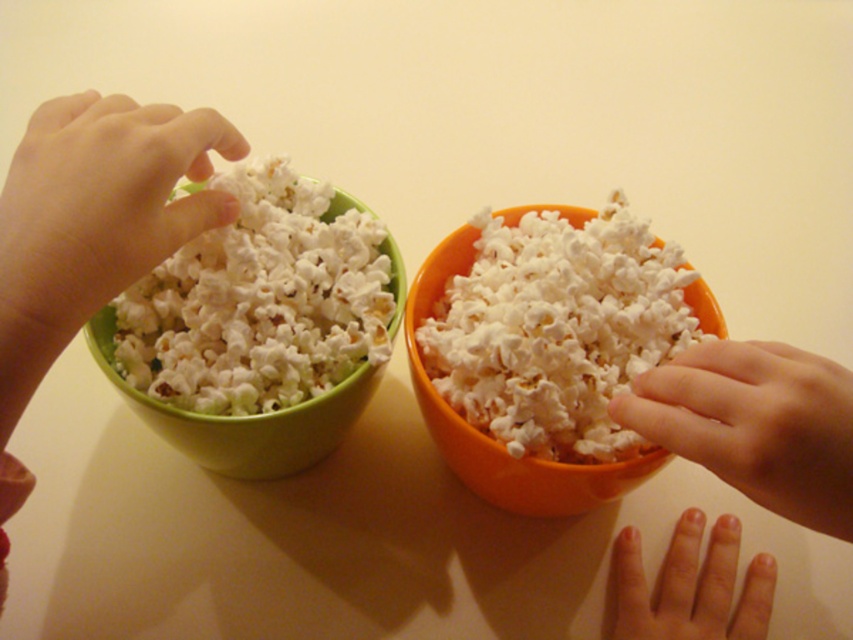
In the scene shown: Does white fluffy popcorn at left have a lesser width compared to matte white hand at left?

Incorrect, white fluffy popcorn at left's width is not less than matte white hand at left's.

Identify the location of white fluffy popcorn at left. Image resolution: width=853 pixels, height=640 pixels. (260, 301).

This screenshot has height=640, width=853. Find the location of `white fluffy popcorn at left`. white fluffy popcorn at left is located at coordinates (260, 301).

Does white fluffy popcorn at right appear over white fluffy popcorn at left?

No, white fluffy popcorn at right is not above white fluffy popcorn at left.

Locate an element on the screen. Image resolution: width=853 pixels, height=640 pixels. white fluffy popcorn at right is located at coordinates (556, 330).

What are the coordinates of `white fluffy popcorn at right` in the screenshot? It's located at (556, 330).

Is matte white hand at left positioned behind smooth skin hand at center?

No, it is in front of smooth skin hand at center.

Does matte white hand at left have a greater height compared to smooth skin hand at center?

Yes, matte white hand at left is taller than smooth skin hand at center.

Locate an element on the screen. The height and width of the screenshot is (640, 853). matte white hand at left is located at coordinates tap(99, 208).